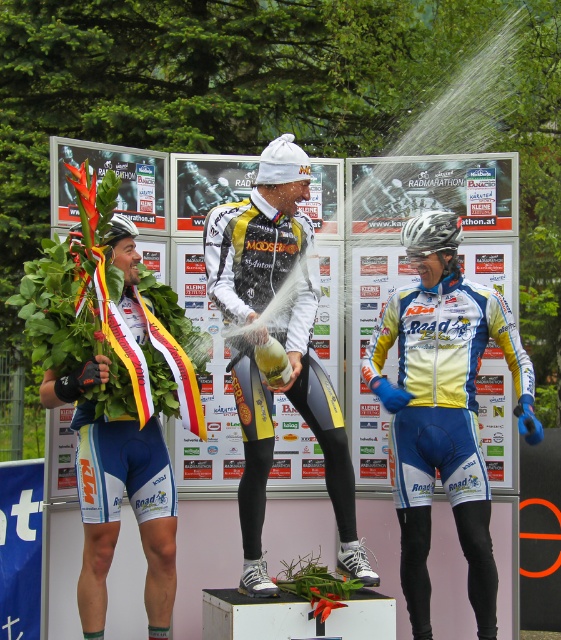
Question: Is yellow/white jersey at center bigger than yellow and black cycling suit at center?

Choices:
 (A) no
 (B) yes

Answer: (B)

Question: Is yellow/white jersey at center closer to the viewer compared to green matte bicycle helmet at center?

Choices:
 (A) no
 (B) yes

Answer: (A)

Question: Does yellow and black cycling suit at center have a greater width compared to green matte bicycle helmet at center?

Choices:
 (A) no
 (B) yes

Answer: (B)

Question: Considering the real-world distances, which object is farthest from the yellow/white jersey at center?

Choices:
 (A) silver metallic helmet at center
 (B) blue/white cycling jersey at left

Answer: (B)

Question: Which point is farther to the camera?

Choices:
 (A) (108, 237)
 (B) (95, 608)
 (C) (449, 220)

Answer: (C)

Question: Which point is closer to the camera taking this photo?

Choices:
 (A) (112, 225)
 (B) (167, 512)
 (C) (256, 506)

Answer: (C)